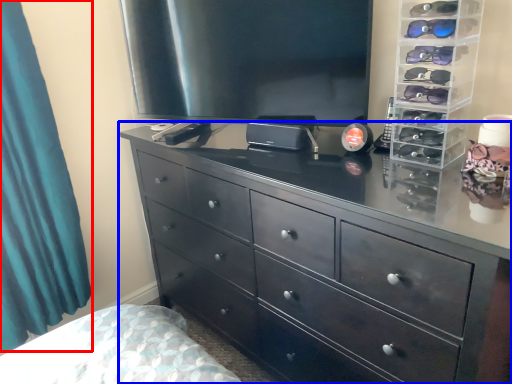
Question: Which of the following is the farthest to the observer, curtain (highlighted by a red box) or chest of drawers (highlighted by a blue box)?

Choices:
 (A) curtain
 (B) chest of drawers

Answer: (A)